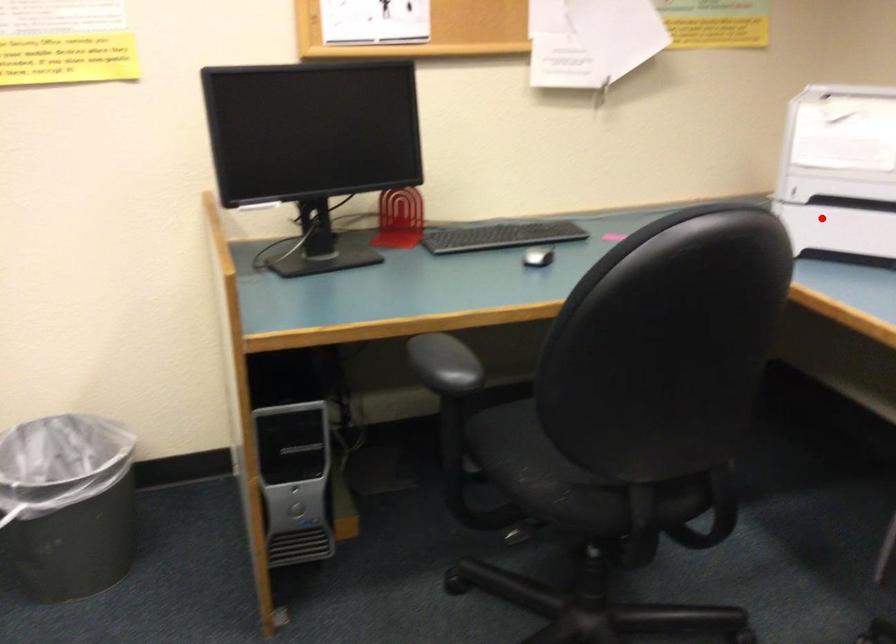
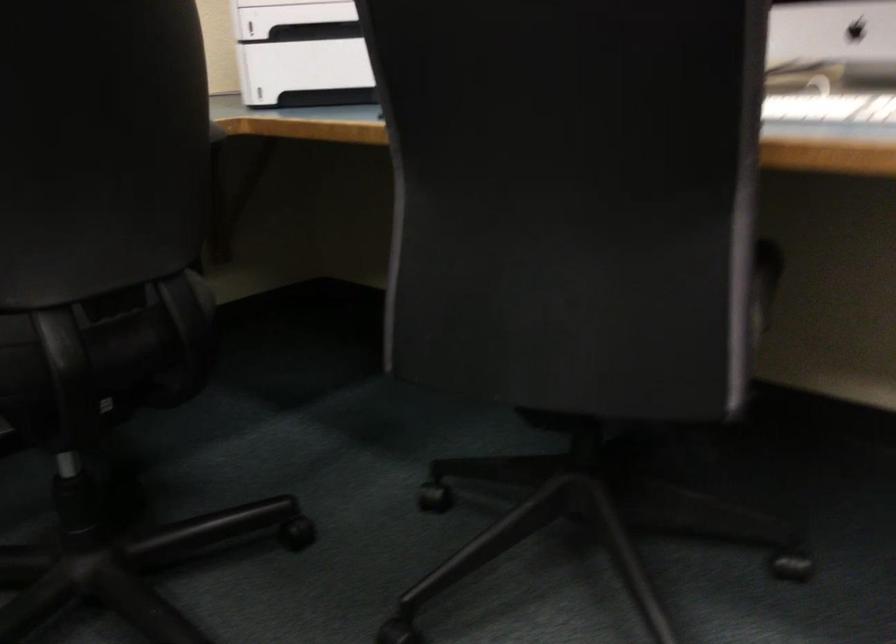
Locate, in the second image, the point that corresponds to the highlighted location in the first image.

(300, 69)